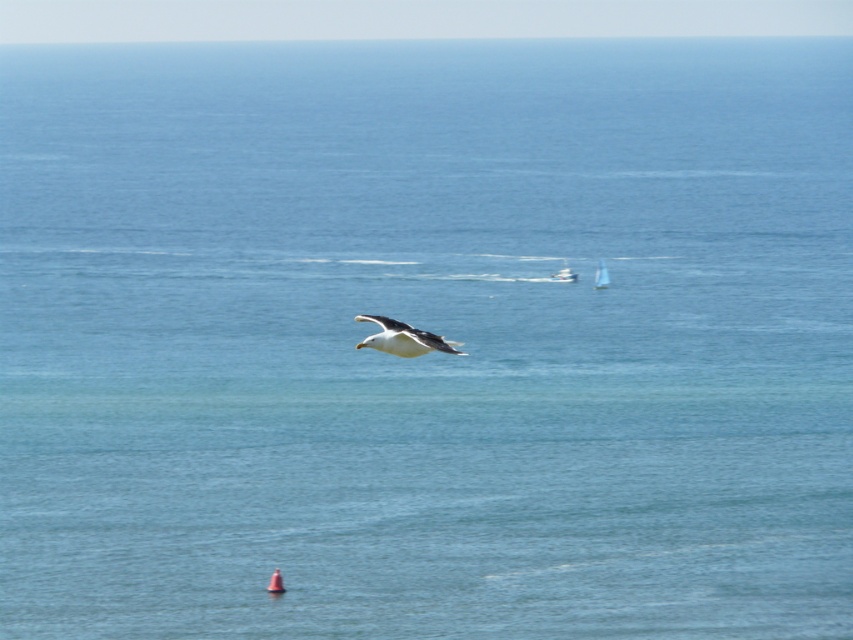
You are a photographer trying to capture a shot of the white matte seagull at center and the white sailboat at center. You want to arrange them in your camera frame so that the seagull is to the right of the sailboat. Is this possible based on their current positions?

The white matte seagull at center is positioned on the left side of the white sailboat at center, so arranging them with the seagull to the right of the sailboat would not be possible with their current positions.

You are standing on the shore looking at the white matte seagull at center and the white sailboat at center in the distance. Which object is nearer to you?

The white matte seagull at center is closer to the viewer than the white sailboat at center, so the seagull is nearer to you.

In the scene shown: You are standing on a cliff overlooking the sea and see both the white matte seagull at center and the white plastic sailboat at center. Which object appears closer to you in terms of height?

The white matte seagull at center has a lesser height compared to the white plastic sailboat at center, so the seagull appears closer to you in terms of height.